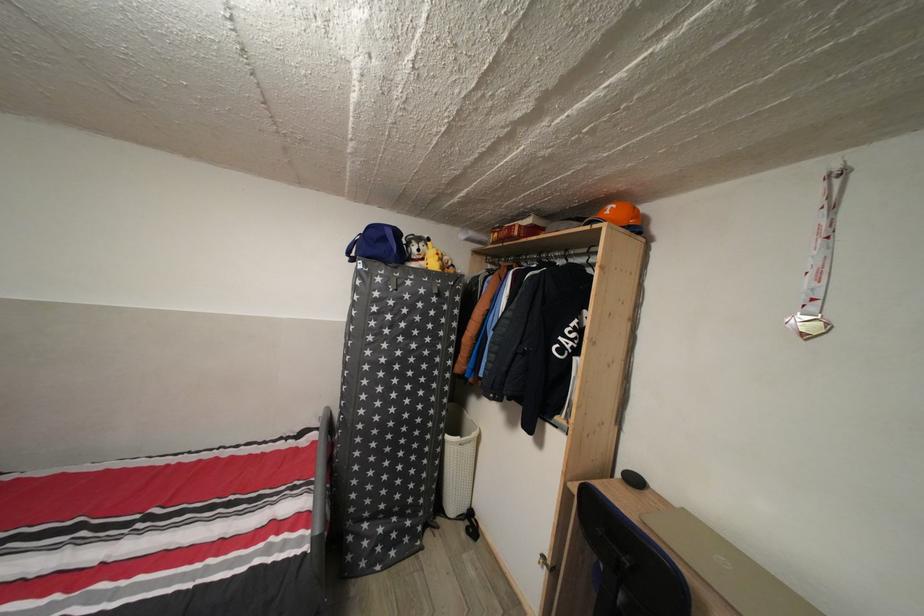
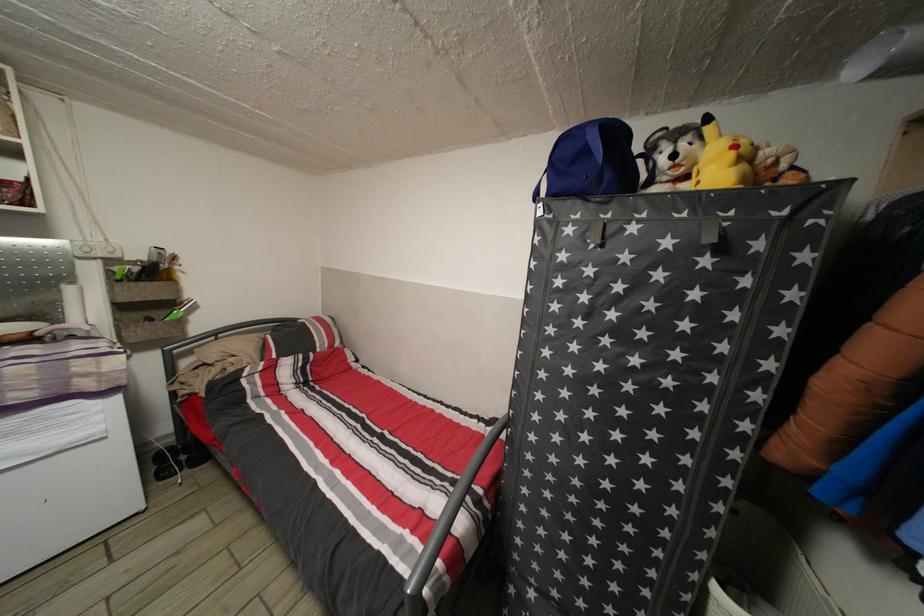
The point at (385, 286) is marked in the first image. Where is the corresponding point in the second image?

(576, 237)